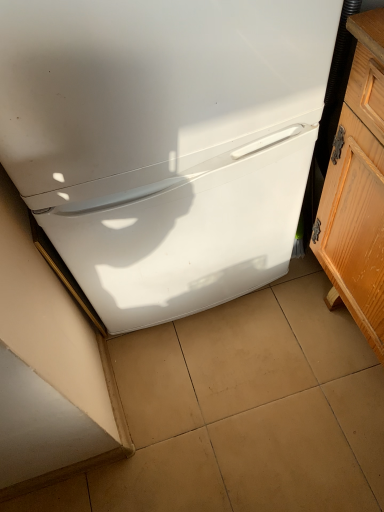
Question: Would you say white glossy refrigerator at center is inside or outside wooden cabinet at right?

Choices:
 (A) outside
 (B) inside

Answer: (A)

Question: From a real-world perspective, is white glossy refrigerator at center above or below wooden cabinet at right?

Choices:
 (A) below
 (B) above

Answer: (B)

Question: Considering the real-world distances, which object is closest to the beige tile at center?

Choices:
 (A) wooden cabinet at right
 (B) white glossy refrigerator at center

Answer: (A)

Question: Which of these objects is positioned closest to the beige tile at center?

Choices:
 (A) white glossy refrigerator at center
 (B) wooden cabinet at right

Answer: (B)